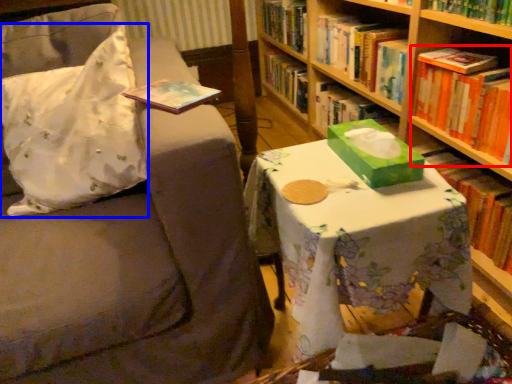
Question: Which object appears farthest to the camera in this image, book (highlighted by a red box) or throw pillow (highlighted by a blue box)?

Choices:
 (A) book
 (B) throw pillow

Answer: (A)